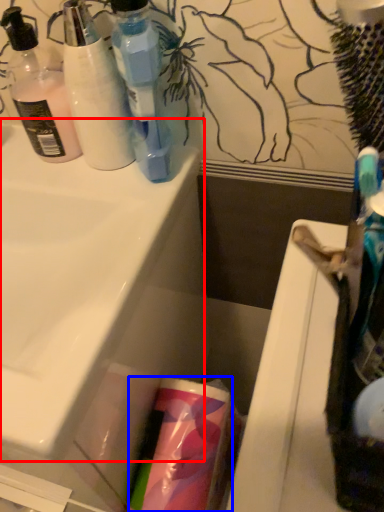
Question: Which of the following is the closest to the observer, sink (highlighted by a red box) or cleaning product (highlighted by a blue box)?

Choices:
 (A) sink
 (B) cleaning product

Answer: (A)